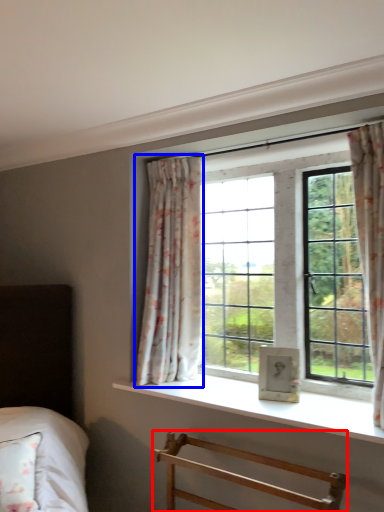
Question: Which object appears farthest to the camera in this image, furniture (highlighted by a red box) or curtain (highlighted by a blue box)?

Choices:
 (A) furniture
 (B) curtain

Answer: (B)